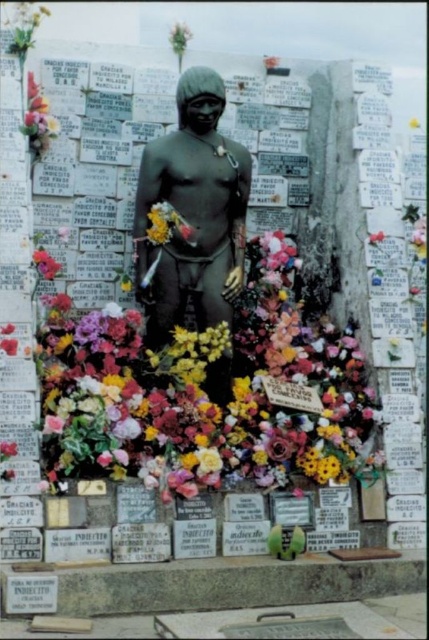
Question: Which object is the farthest from the floral bouquet at upper left?

Choices:
 (A) fluffy silk flowers at center
 (B) bronze statue at center

Answer: (A)

Question: Is bronze statue at center positioned before floral bouquet at upper left?

Choices:
 (A) yes
 (B) no

Answer: (A)

Question: Does fluffy silk flowers at center have a greater width compared to floral bouquet at upper left?

Choices:
 (A) no
 (B) yes

Answer: (B)

Question: Which object appears farthest from the camera in this image?

Choices:
 (A) fluffy silk flowers at center
 (B) floral bouquet at upper left

Answer: (B)

Question: Among these points, which one is nearest to the camera?

Choices:
 (A) (271, 362)
 (B) (39, 97)
 (C) (199, 161)

Answer: (C)

Question: Can you confirm if fluffy silk flowers at center is positioned below bronze statue at center?

Choices:
 (A) no
 (B) yes

Answer: (B)